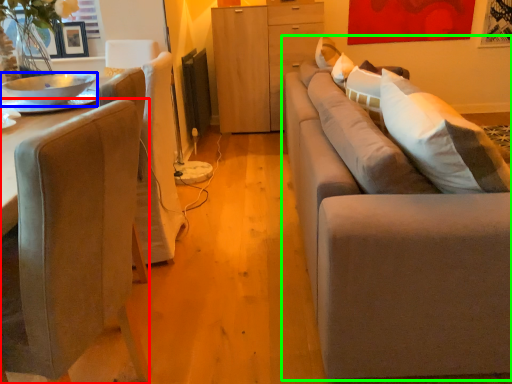
Question: Estimate the real-world distances between objects in this image. Which object is farther from chair (highlighted by a red box), bowl (highlighted by a blue box) or studio couch (highlighted by a green box)?

Choices:
 (A) bowl
 (B) studio couch

Answer: (A)